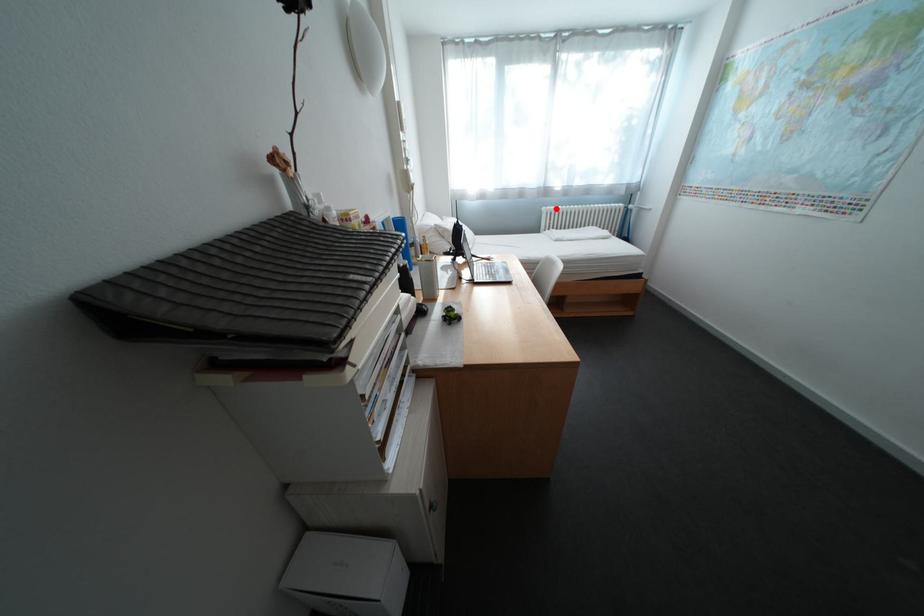
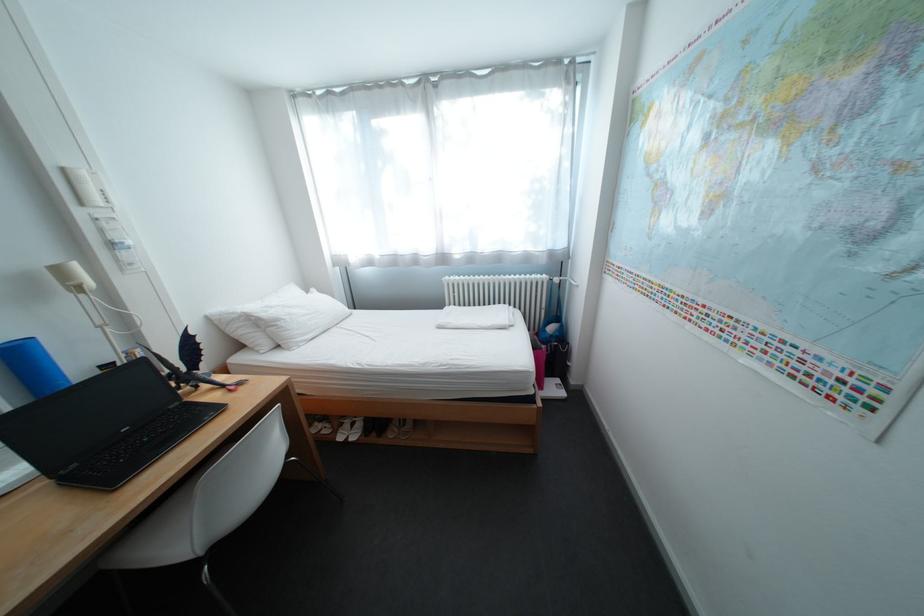
In the second image, find the point that corresponds to the highlighted location in the first image.

(459, 278)